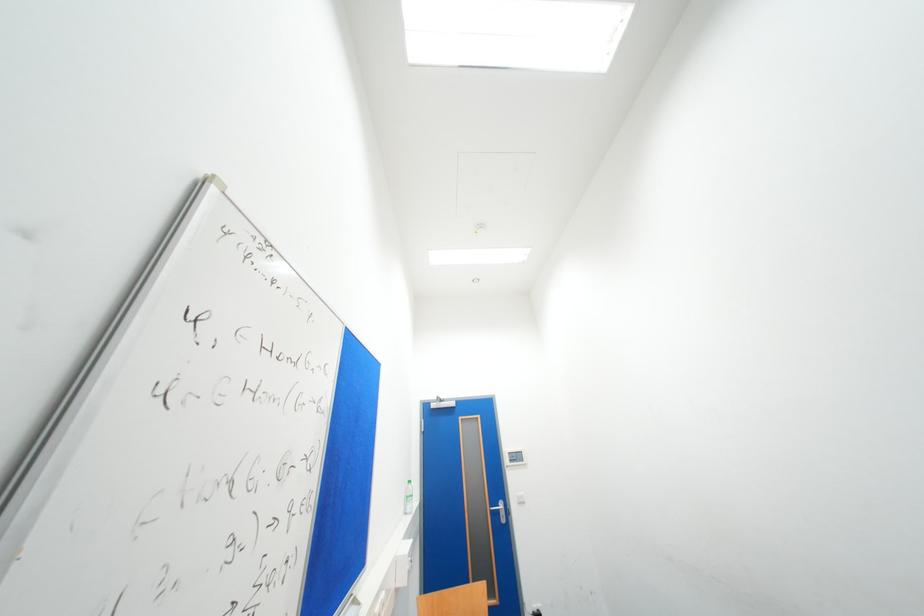
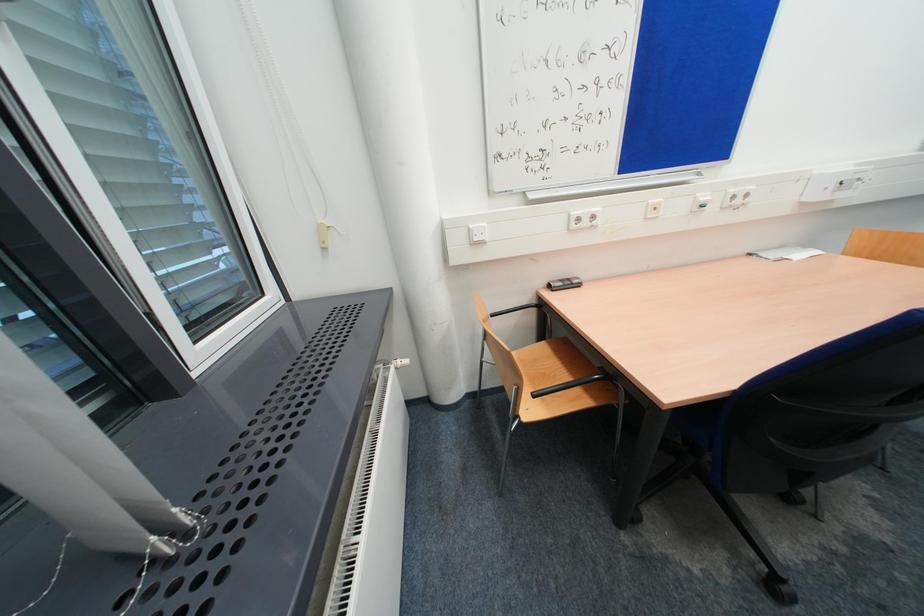
From the picture: How did the camera likely rotate?

The camera's rotation is toward left-down.